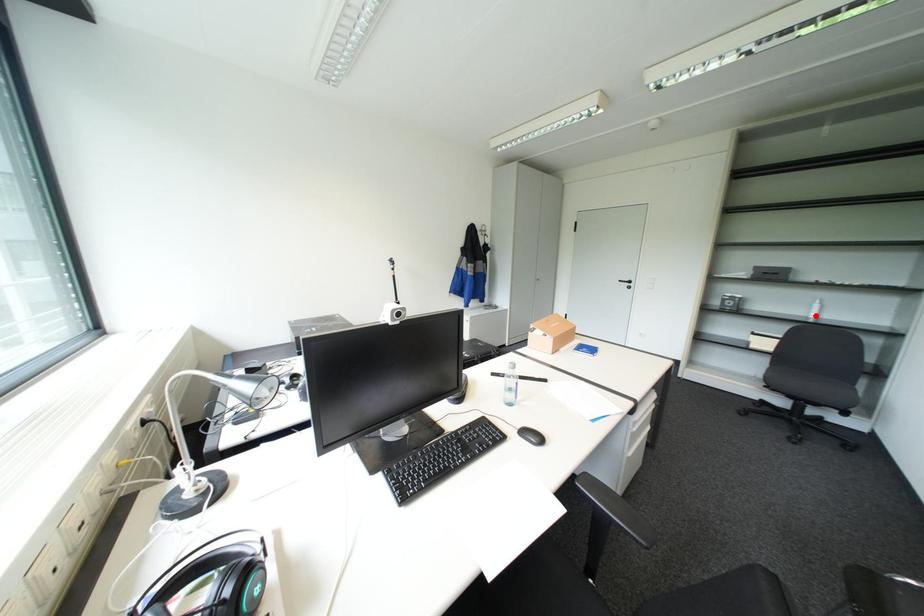
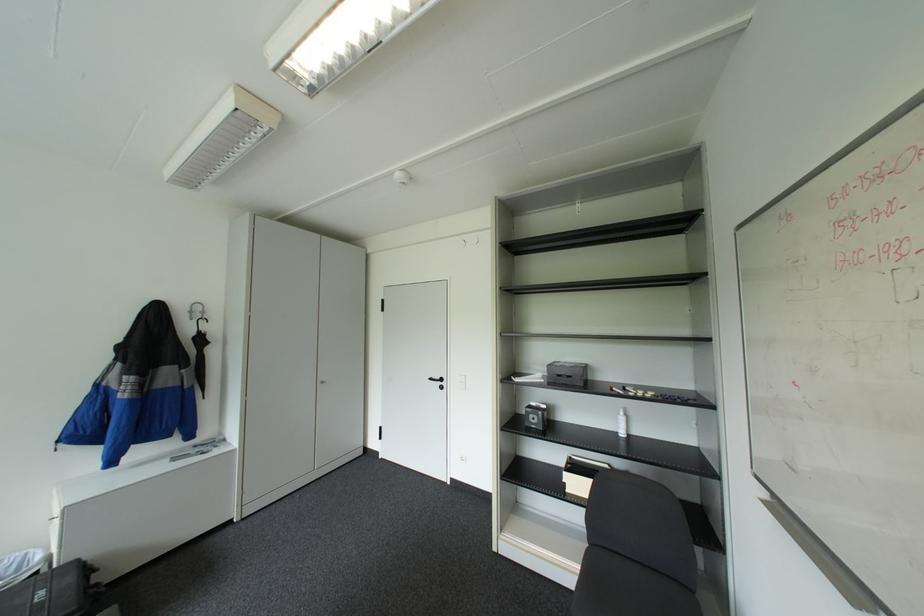
Question: I am providing you with two images of the same scene from different viewpoints. Given a red point in image1, look at the same physical point in image2. Is it:

Choices:
 (A) Closer to the viewpoint
 (B) Farther from the viewpoint

Answer: (B)